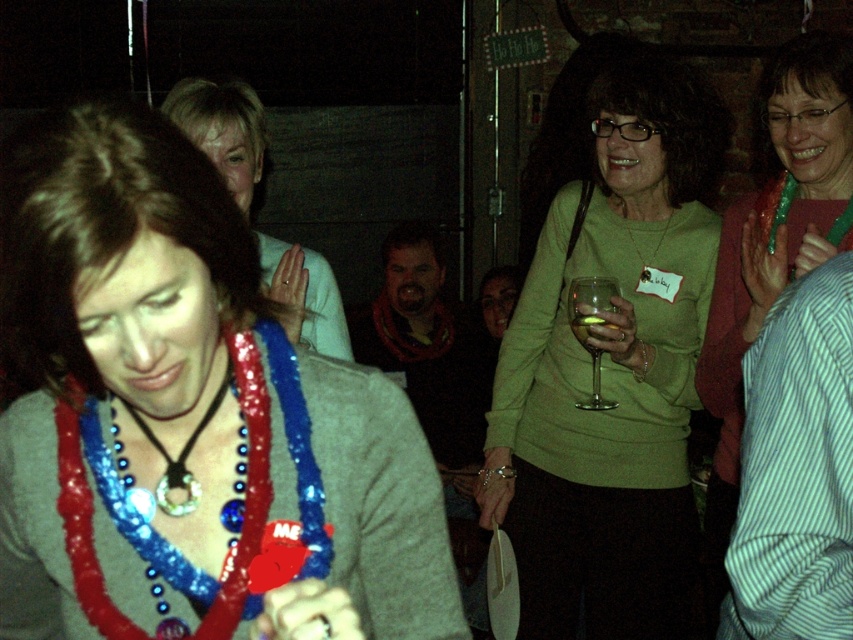
Question: Which point is farther to the camera?

Choices:
 (A) silver metallic tag at upper center
 (B) clear glass wine glass at center
 (C) blue beaded necklace at center
 (D) shiny plastic necklace at center

Answer: (A)

Question: Does clear glass wine glass at center appear over blue beaded necklace at center?

Choices:
 (A) yes
 (B) no

Answer: (A)

Question: Estimate the real-world distances between objects in this image. Which object is farther from the green shiny necklace at upper right?

Choices:
 (A) silver metallic tag at upper center
 (B) green matte sweater at center
 (C) shiny sequin necklace at center

Answer: (C)

Question: Is green matte sweater at center bigger than shiny plastic necklace at center?

Choices:
 (A) yes
 (B) no

Answer: (A)

Question: Considering the real-world distances, which object is farthest from the transparent glass at center?

Choices:
 (A) green shiny necklace at upper right
 (B) green matte sweater at center
 (C) shiny sequin necklace at center
 (D) shiny plastic necklace at center

Answer: (C)

Question: Observing the image, what is the correct spatial positioning of green matte sweater at center in reference to shiny plastic necklace at center?

Choices:
 (A) left
 (B) right

Answer: (B)